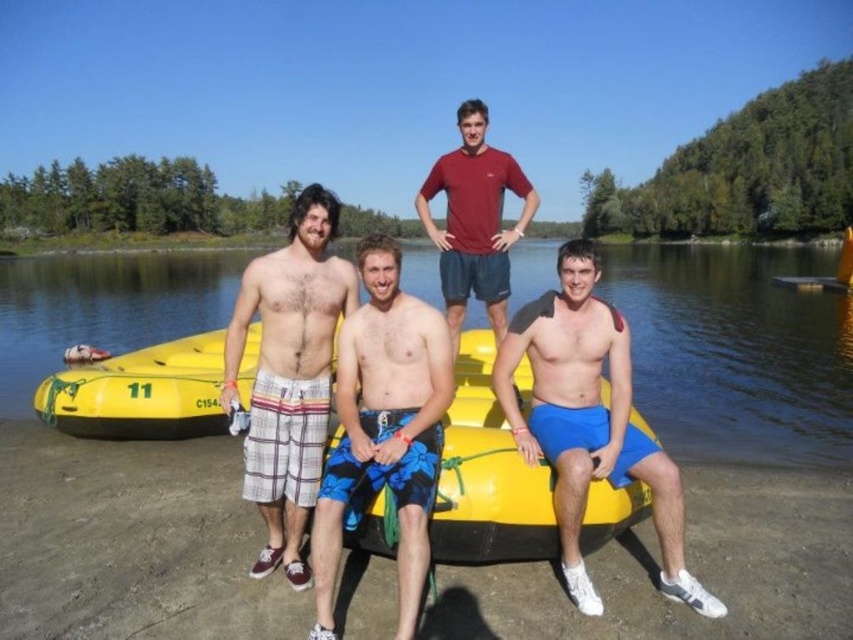
Question: Does yellow rubber raft at center appear on the left side of hairy skin at center?

Choices:
 (A) yes
 (B) no

Answer: (B)

Question: Is blue printed shorts at center smaller than matte red t-shirt at center?

Choices:
 (A) yes
 (B) no

Answer: (A)

Question: Estimate the real-world distances between objects in this image. Which object is closer to the yellow rubber raft at center?

Choices:
 (A) matte red t-shirt at center
 (B) blue printed shorts at center
 (C) yellow rubber canoe at center
 (D) blue fabric shorts at center

Answer: (B)

Question: Which object is closer to the camera taking this photo?

Choices:
 (A) blue printed shorts at center
 (B) matte red t-shirt at center
 (C) yellow rubber raft at center
 (D) yellow rubber canoe at center

Answer: (A)

Question: Can you confirm if yellow rubber raft at center is bigger than yellow rubber canoe at center?

Choices:
 (A) no
 (B) yes

Answer: (B)

Question: Which object is positioned closest to the plaid shorts at center?

Choices:
 (A) hairy skin at center
 (B) blue printed shorts at center
 (C) yellow rubber raft at center
 (D) yellow rubber canoe at center

Answer: (A)